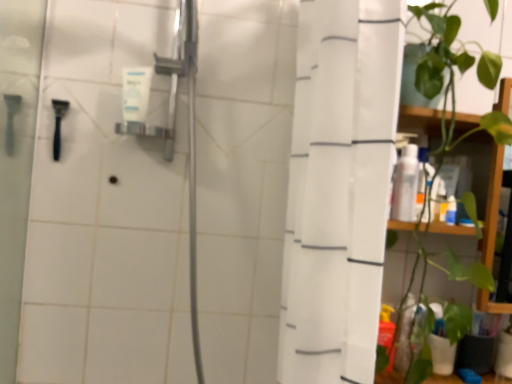
What is the approximate width of white matte tube at upper center, the 2th toiletry positioned from the bottom?

It is 1.26 inches.

What is the approximate height of white matte tube at upper center, the 2th toiletry positioned from the bottom?

white matte tube at upper center, the 2th toiletry positioned from the bottom, is 5.27 inches in height.

Describe the element at coordinates (339, 188) in the screenshot. I see `white fabric shower curtain at right` at that location.

Describe the element at coordinates (405, 185) in the screenshot. The image size is (512, 384). I see `white glossy bottle at right, the 2th toiletry viewed from the left` at that location.

Locate an element on the screen. The height and width of the screenshot is (384, 512). white glossy bottle at right, marked as the first toiletry in a bottom-to-top arrangement is located at coordinates (405, 185).

Where is `white matte tube at upper center, marked as the first toiletry in a left-to-right arrangement`? The height and width of the screenshot is (384, 512). white matte tube at upper center, marked as the first toiletry in a left-to-right arrangement is located at coordinates (136, 92).

Does white matte tube at upper center, marked as the first toiletry in a left-to-right arrangement, have a larger size compared to white fabric shower curtain at right?

Incorrect, white matte tube at upper center, marked as the first toiletry in a left-to-right arrangement, is not larger than white fabric shower curtain at right.

Does point (133, 118) come in front of point (292, 375)?

That is False.

Considering their positions, is black plastic razor at left located in front of or behind white fabric shower curtain at right?

Visually, black plastic razor at left is located behind white fabric shower curtain at right.

The height and width of the screenshot is (384, 512). I want to click on shower curtain below the black plastic razor at left (from the image's perspective), so click(339, 188).

Considering the positions of point (60, 122) and point (372, 55), is point (60, 122) closer or farther from the camera than point (372, 55)?

Point (60, 122) is positioned farther from the camera compared to point (372, 55).

Is white matte tube at upper center, acting as the second toiletry starting from the right, completely or partially inside black plastic razor at left?

No, white matte tube at upper center, acting as the second toiletry starting from the right, is not surrounded by black plastic razor at left.

Is there a large distance between black plastic razor at left and white matte tube at upper center, marked as the first toiletry in a left-to-right arrangement?

That's not correct — black plastic razor at left is a little close to white matte tube at upper center, marked as the first toiletry in a left-to-right arrangement.

Who is taller, black plastic razor at left or white matte tube at upper center, acting as the second toiletry starting from the right?

Standing taller between the two is black plastic razor at left.

Does black plastic razor at left turn towards white matte tube at upper center, marked as the first toiletry in a left-to-right arrangement?

No, black plastic razor at left is not oriented towards white matte tube at upper center, marked as the first toiletry in a left-to-right arrangement.

Considering the positions of objects white glossy bottle at right, the 2th toiletry viewed from the left, and green leafy plant at right in the image provided, who is more to the left, white glossy bottle at right, the 2th toiletry viewed from the left, or green leafy plant at right?

white glossy bottle at right, the 2th toiletry viewed from the left.

Is green leafy plant at right located within white glossy bottle at right, the 2th toiletry viewed from the left?

No, green leafy plant at right is not inside white glossy bottle at right, the 2th toiletry viewed from the left.

Is white glossy bottle at right, which appears as the 1th toiletry when viewed from the right, far from green leafy plant at right?

No, there isn't a large distance between white glossy bottle at right, which appears as the 1th toiletry when viewed from the right, and green leafy plant at right.

Is white glossy bottle at right, the 2th toiletry viewed from the left, closer to the viewer compared to green leafy plant at right?

No, white glossy bottle at right, the 2th toiletry viewed from the left, is further to the viewer.

Looking at this image, is green leafy plant at right in front of or behind white fabric shower curtain at right in the image?

Clearly, green leafy plant at right is behind white fabric shower curtain at right.

Which is more to the right, green leafy plant at right or white fabric shower curtain at right?

green leafy plant at right is more to the right.

Where is `houseplant located above the white fabric shower curtain at right (from a real-world perspective)`? This screenshot has width=512, height=384. houseplant located above the white fabric shower curtain at right (from a real-world perspective) is located at coordinates (452, 81).

Based on the photo, does green leafy plant at right have a smaller size compared to white fabric shower curtain at right?

Actually, green leafy plant at right might be larger than white fabric shower curtain at right.

In the scene shown: Which object is thinner, black plastic razor at left or green leafy plant at right?

With smaller width is black plastic razor at left.

Considering the positions of objects black plastic razor at left and green leafy plant at right in the image provided, who is more to the left, black plastic razor at left or green leafy plant at right?

black plastic razor at left.

Which point is more distant from viewer, (59, 134) or (480, 79)?

Point (59, 134)

Is the surface of black plastic razor at left in direct contact with green leafy plant at right?

black plastic razor at left is not next to green leafy plant at right, and they're not touching.

Which object is closer to the camera taking this photo, white fabric shower curtain at right or white matte tube at upper center, acting as the second toiletry starting from the right?

white fabric shower curtain at right is more forward.

Which object is thinner, white fabric shower curtain at right or white matte tube at upper center, the 2th toiletry positioned from the bottom?

Thinner between the two is white matte tube at upper center, the 2th toiletry positioned from the bottom.

From the image's perspective, count 2nd toiletrys upward from the white fabric shower curtain at right and point to it. Please provide its 2D coordinates.

[(136, 92)]

In the image, is white fabric shower curtain at right on the left side or the right side of white matte tube at upper center, which is the first toiletry in top-to-bottom order?

white fabric shower curtain at right is positioned on white matte tube at upper center, which is the first toiletry in top-to-bottom order,'s right side.

Identify the location of toiletry on the left side of white fabric shower curtain at right. The width and height of the screenshot is (512, 384). (136, 92).

Image resolution: width=512 pixels, height=384 pixels. In order to click on shower curtain lying below the black plastic razor at left (from the image's perspective) in this screenshot , I will do `click(339, 188)`.

Based on the photo, estimate the real-world distances between objects in this image. Which object is further from white fabric shower curtain at right, white matte tube at upper center, acting as the second toiletry starting from the right, or green leafy plant at right?

white matte tube at upper center, acting as the second toiletry starting from the right, is further to white fabric shower curtain at right.

From the image, which object appears to be farther from white glossy bottle at right, which appears as the 1th toiletry when viewed from the right, white fabric shower curtain at right or black plastic razor at left?

black plastic razor at left lies further to white glossy bottle at right, which appears as the 1th toiletry when viewed from the right, than the other object.

Which object lies further to the anchor point green leafy plant at right, white fabric shower curtain at right or white matte tube at upper center, acting as the second toiletry starting from the right?

white matte tube at upper center, acting as the second toiletry starting from the right.

Estimate the real-world distances between objects in this image. Which object is closer to black plastic razor at left, white glossy bottle at right, which appears as the 1th toiletry when viewed from the right, or white fabric shower curtain at right?

Among the two, white fabric shower curtain at right is located nearer to black plastic razor at left.

Considering their positions, is white glossy bottle at right, which appears as the 1th toiletry when viewed from the right, positioned further to white matte tube at upper center, marked as the first toiletry in a left-to-right arrangement, than green leafy plant at right?

Among the two, green leafy plant at right is located further to white matte tube at upper center, marked as the first toiletry in a left-to-right arrangement.

Estimate the real-world distances between objects in this image. Which object is further from white matte tube at upper center, which is the first toiletry in top-to-bottom order, green leafy plant at right or black plastic razor at left?

The object further to white matte tube at upper center, which is the first toiletry in top-to-bottom order, is green leafy plant at right.

From the image, which object appears to be farther from white fabric shower curtain at right, black plastic razor at left or white matte tube at upper center, which is the first toiletry in top-to-bottom order?

black plastic razor at left is positioned further to the anchor white fabric shower curtain at right.

When comparing their distances from green leafy plant at right, does white glossy bottle at right, the second toiletry when ordered from top to bottom, or white matte tube at upper center, which is the first toiletry in top-to-bottom order, seem closer?

The object closer to green leafy plant at right is white glossy bottle at right, the second toiletry when ordered from top to bottom.

Image resolution: width=512 pixels, height=384 pixels. I want to click on shower curtain between white matte tube at upper center, acting as the second toiletry starting from the right, and green leafy plant at right, in the horizontal direction, so click(339, 188).

This screenshot has width=512, height=384. In order to click on toiletry between black plastic razor at left and white glossy bottle at right, the 2th toiletry viewed from the left in this screenshot , I will do `click(136, 92)`.

Where is `shower curtain between white matte tube at upper center, marked as the first toiletry in a left-to-right arrangement, and white glossy bottle at right, the second toiletry when ordered from top to bottom`? This screenshot has height=384, width=512. shower curtain between white matte tube at upper center, marked as the first toiletry in a left-to-right arrangement, and white glossy bottle at right, the second toiletry when ordered from top to bottom is located at coordinates (339, 188).

The image size is (512, 384). What are the coordinates of `shower curtain between black plastic razor at left and green leafy plant at right` in the screenshot? It's located at (339, 188).